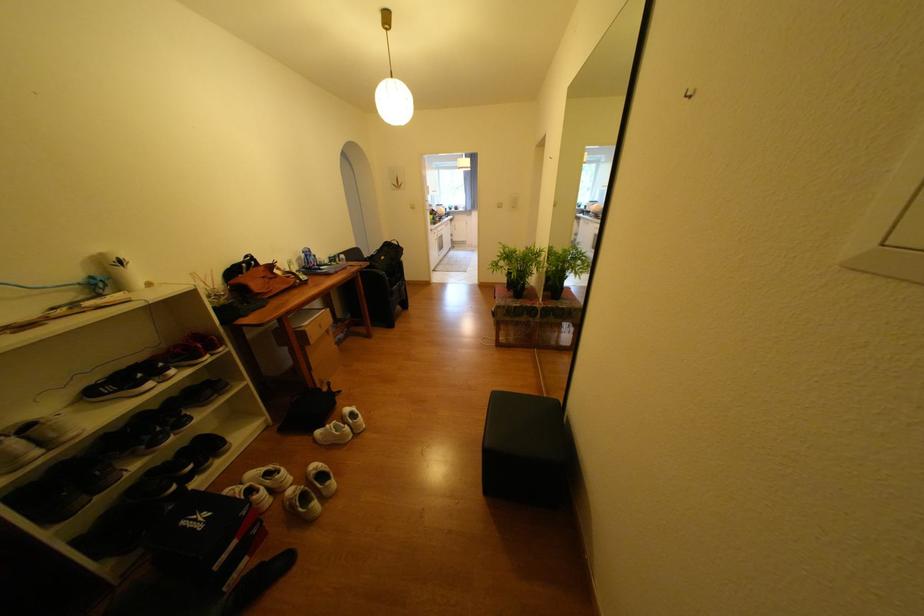
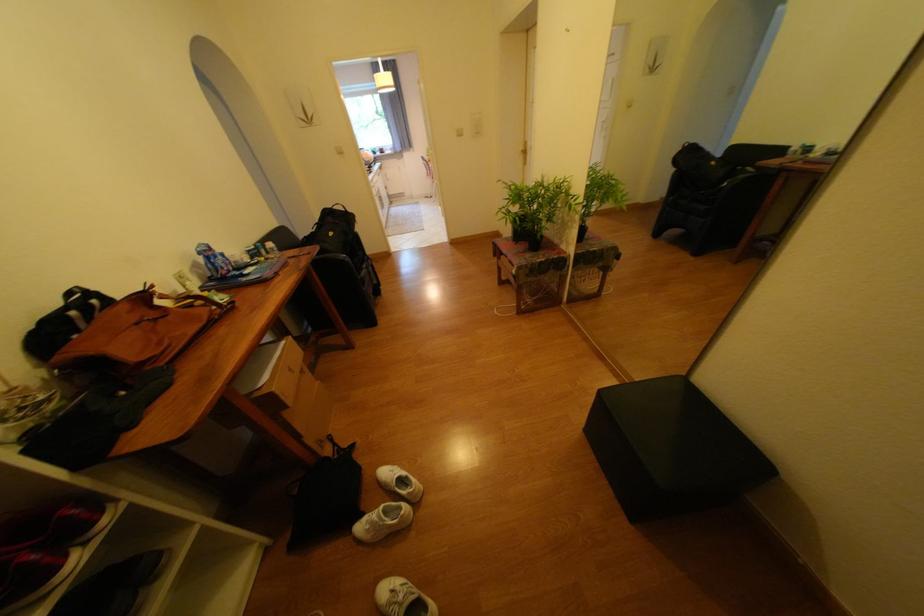
Question: The images are taken continuously from a first-person perspective. In which direction is your viewpoint rotating?

Choices:
 (A) Left
 (B) Right
 (C) Up
 (D) Down

Answer: (D)